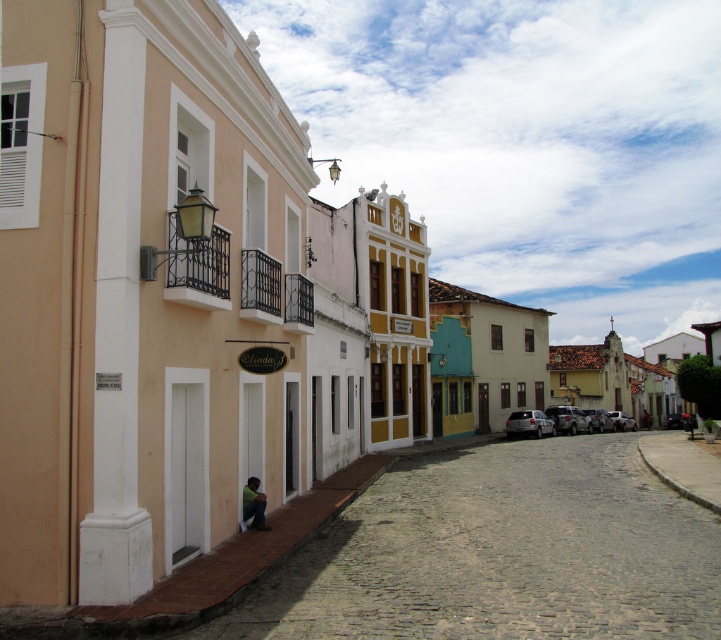
Question: Which point is farther to the camera?

Choices:
 (A) dark green fabric at lower center
 (B) white painted wall at lower left

Answer: (A)

Question: Can you confirm if white painted wall at lower left is thinner than dark green fabric at lower center?

Choices:
 (A) no
 (B) yes

Answer: (A)

Question: Does white painted wall at lower left have a lesser width compared to dark green fabric at lower center?

Choices:
 (A) no
 (B) yes

Answer: (A)

Question: Which point is closer to the camera?

Choices:
 (A) (464, 490)
 (B) (252, 481)

Answer: (B)

Question: Can you confirm if white painted wall at lower left is thinner than dark green fabric at lower center?

Choices:
 (A) yes
 (B) no

Answer: (B)